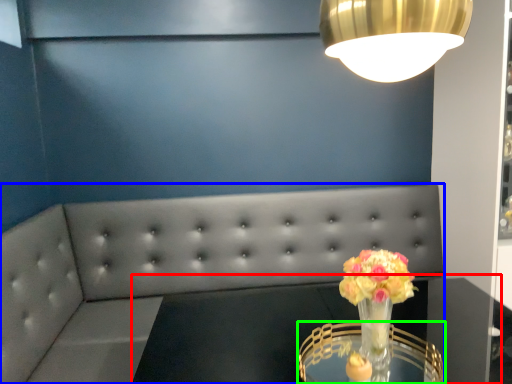
Question: Which is farther away from round table (highlighted by a red box)? studio couch (highlighted by a blue box) or table (highlighted by a green box)?

Choices:
 (A) studio couch
 (B) table

Answer: (A)